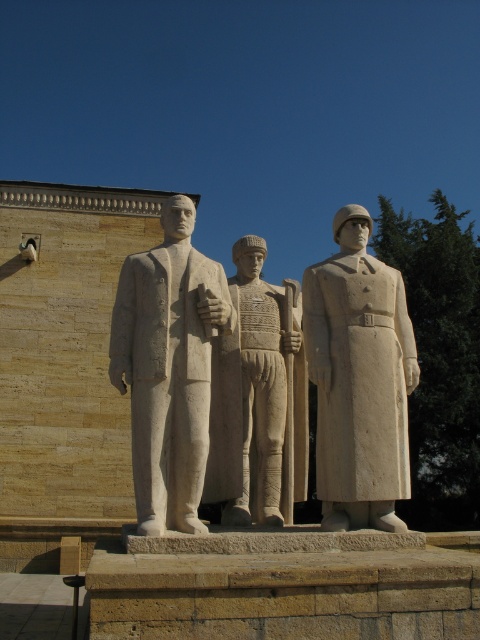
Looking at this image, you are an art student analyzing the statues in the image. You notice two central figures labeled as a white stone statue at center and a white stone figure at center. Which one is taller?

The white stone statue at center is taller than the white stone figure at center.

What is the significance of the point located at coordinates (359, 380) in the image?

The point at coordinates (359, 380) is located on the white stone soldier at center.

You are an art curator planning to move the white stone soldier at center and the white stone statue at center to a new exhibition space. The new space has a narrow corridor that can only accommodate items up to 1.2 meters in width. Based on the information provided, can both items be safely transported through the corridor?

The white stone soldier at center is less in width than the white stone statue at center. However, the exact width of the white stone statue at center is not provided. Therefore, it is uncertain if both items can fit through the 1.2 meter corridor without further information about their dimensions.